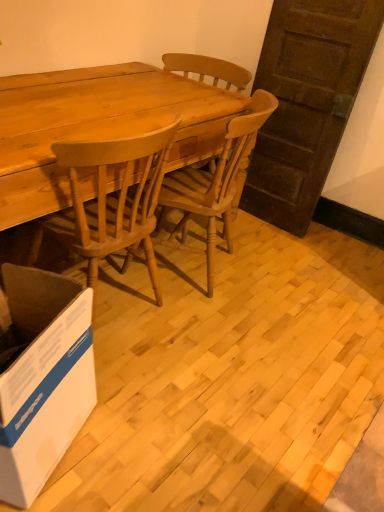
Question: From the image's perspective, would you say light brown wood desk at center is positioned over white cardboard box at lower left?

Choices:
 (A) yes
 (B) no

Answer: (A)

Question: Is light brown wood desk at center shorter than white cardboard box at lower left?

Choices:
 (A) yes
 (B) no

Answer: (B)

Question: Is light brown wood desk at center to the right of white cardboard box at lower left from the viewer's perspective?

Choices:
 (A) no
 (B) yes

Answer: (B)

Question: Can you see light brown wood desk at center touching white cardboard box at lower left?

Choices:
 (A) no
 (B) yes

Answer: (A)

Question: Is light brown wood desk at center taller than white cardboard box at lower left?

Choices:
 (A) no
 (B) yes

Answer: (B)

Question: Is the position of light brown wood desk at center more distant than that of white cardboard box at lower left?

Choices:
 (A) yes
 (B) no

Answer: (A)

Question: Considering the relative sizes of white cardboard box at lower left and light brown wood desk at center in the image provided, is white cardboard box at lower left taller than light brown wood desk at center?

Choices:
 (A) yes
 (B) no

Answer: (B)

Question: Can you confirm if white cardboard box at lower left is wider than light brown wood desk at center?

Choices:
 (A) yes
 (B) no

Answer: (B)

Question: From a real-world perspective, is white cardboard box at lower left over light brown wood desk at center?

Choices:
 (A) yes
 (B) no

Answer: (B)

Question: Is white cardboard box at lower left directly adjacent to light brown wood desk at center?

Choices:
 (A) no
 (B) yes

Answer: (A)

Question: Is light brown wood desk at center surrounded by white cardboard box at lower left?

Choices:
 (A) yes
 (B) no

Answer: (B)

Question: Is white cardboard box at lower left bigger than light brown wood desk at center?

Choices:
 (A) yes
 (B) no

Answer: (B)

Question: Is light brown wood chair at center at the right side of light brown wood desk at center?

Choices:
 (A) no
 (B) yes

Answer: (B)